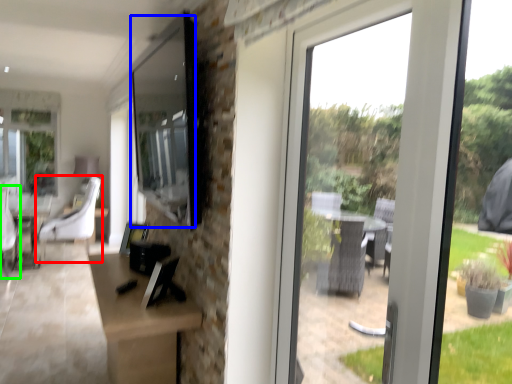
Question: Which object is the farthest from chair (highlighted by a red box)? Choose among these: window screen (highlighted by a blue box) or swivel chair (highlighted by a green box).

Choices:
 (A) window screen
 (B) swivel chair

Answer: (A)